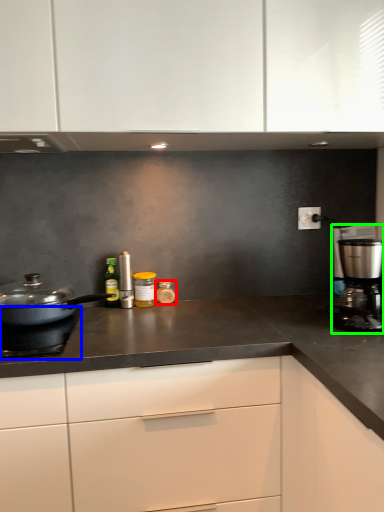
Question: Estimate the real-world distances between objects in this image. Which object is farther from kitchen appliance (highlighted by a red box), gas stove (highlighted by a blue box) or kitchen appliance (highlighted by a green box)?

Choices:
 (A) gas stove
 (B) kitchen appliance

Answer: (B)